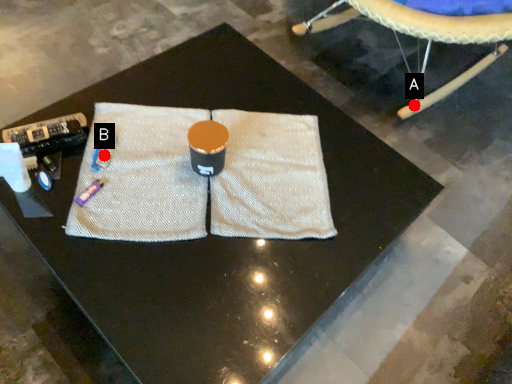
Question: Two points are circled on the image, labeled by A and B beside each circle. Which of the following is the closest to the observer?

Choices:
 (A) A is closer
 (B) B is closer

Answer: (B)